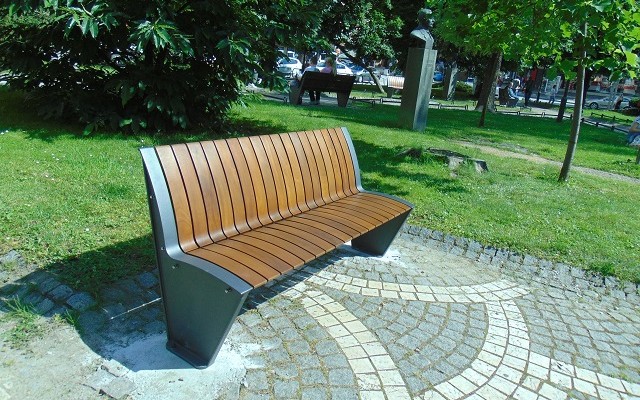
I want to click on floor, so click(x=445, y=367).